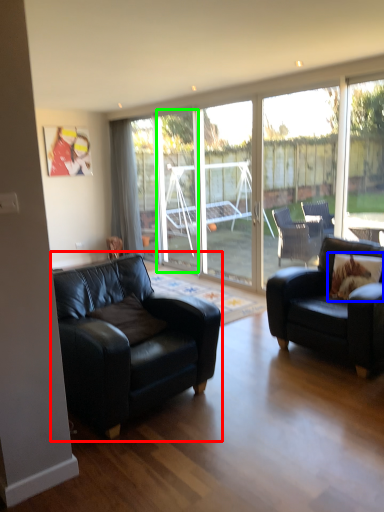
Question: Which object is the closest to the studio couch (highlighted by a red box)? Choose among these: pillow (highlighted by a blue box) or glass door (highlighted by a green box).

Choices:
 (A) pillow
 (B) glass door

Answer: (A)